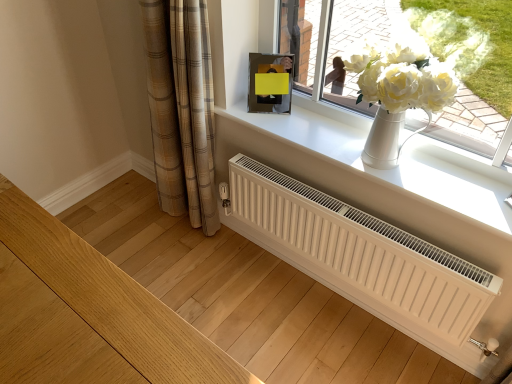
Question: Is point (253, 72) positioned closer to the camera than point (413, 185)?

Choices:
 (A) closer
 (B) farther

Answer: (B)

Question: Considering the positions of metallic reflective picture frame at upper center and white smooth window sill at upper center in the image, is metallic reflective picture frame at upper center wider or thinner than white smooth window sill at upper center?

Choices:
 (A) thin
 (B) wide

Answer: (A)

Question: Based on their relative distances, which object is nearer to the white ceramic vase at upper center?

Choices:
 (A) plaid fabric curtain at lower left
 (B) white smooth window sill at upper center
 (C) metallic reflective picture frame at upper center
 (D) white matte radiator at center

Answer: (C)

Question: Based on their relative distances, which object is farther from the white smooth window sill at upper center?

Choices:
 (A) metallic reflective picture frame at upper center
 (B) white matte radiator at center
 (C) plaid fabric curtain at lower left
 (D) white ceramic vase at upper center

Answer: (C)